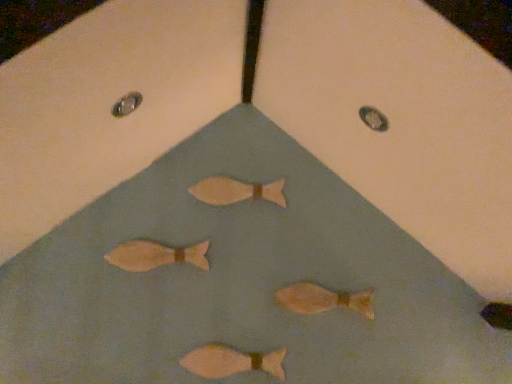
Question: Is matte pink fish at center, marked as the fourth fish in a top-to-bottom arrangement, inside matte orange fish at center, the second fish ordered from the bottom?

Choices:
 (A) yes
 (B) no

Answer: (B)

Question: Is matte orange fish at center, the second fish ordered from the bottom, smaller than matte pink fish at center, marked as the fourth fish in a top-to-bottom arrangement?

Choices:
 (A) yes
 (B) no

Answer: (B)

Question: Is matte orange fish at center, the second fish ordered from the bottom, in front of matte pink fish at center, the first fish ordered from the bottom?

Choices:
 (A) no
 (B) yes

Answer: (A)

Question: From a real-world perspective, does matte orange fish at center, which appears as the 3th fish when viewed from the top, sit lower than matte pink fish at center, the first fish ordered from the bottom?

Choices:
 (A) no
 (B) yes

Answer: (A)

Question: Can you confirm if matte orange fish at center, which appears as the 3th fish when viewed from the top, is thinner than matte pink fish at center, marked as the fourth fish in a top-to-bottom arrangement?

Choices:
 (A) yes
 (B) no

Answer: (B)

Question: Which is correct: matte pink fish at center, marked as the fourth fish in a top-to-bottom arrangement, is inside matte wooden fish at center, positioned as the first fish in top-to-bottom order, or outside of it?

Choices:
 (A) inside
 (B) outside

Answer: (B)

Question: From a real-world perspective, is matte pink fish at center, the first fish ordered from the bottom, above or below matte wooden fish at center, positioned as the first fish in top-to-bottom order?

Choices:
 (A) below
 (B) above

Answer: (A)

Question: From the image's perspective, is matte pink fish at center, marked as the fourth fish in a top-to-bottom arrangement, positioned above or below matte wooden fish at center, positioned as the fourth fish in bottom-to-top order?

Choices:
 (A) below
 (B) above

Answer: (A)

Question: Considering the positions of point (258, 360) and point (259, 190), is point (258, 360) closer or farther from the camera than point (259, 190)?

Choices:
 (A) closer
 (B) farther

Answer: (A)

Question: Is matte pink fish at center, the first fish ordered from the bottom, in front of or behind matte orange fish at center, which appears as the 3th fish when viewed from the top, in the image?

Choices:
 (A) behind
 (B) front

Answer: (B)

Question: Does point (230, 372) appear closer or farther from the camera than point (311, 291)?

Choices:
 (A) closer
 (B) farther

Answer: (A)

Question: Is matte pink fish at center, marked as the fourth fish in a top-to-bottom arrangement, taller or shorter than matte orange fish at center, which appears as the 3th fish when viewed from the top?

Choices:
 (A) tall
 (B) short

Answer: (B)

Question: From the image's perspective, relative to matte orange fish at center, which appears as the 3th fish when viewed from the top, is matte pink fish at center, marked as the fourth fish in a top-to-bottom arrangement, above or below?

Choices:
 (A) below
 (B) above

Answer: (A)

Question: Considering the positions of point (130, 246) and point (243, 187), is point (130, 246) closer or farther from the camera than point (243, 187)?

Choices:
 (A) farther
 (B) closer

Answer: (B)

Question: Is matte brown fish at center, the third fish positioned from the bottom, wider or thinner than matte wooden fish at center, positioned as the first fish in top-to-bottom order?

Choices:
 (A) wide
 (B) thin

Answer: (A)